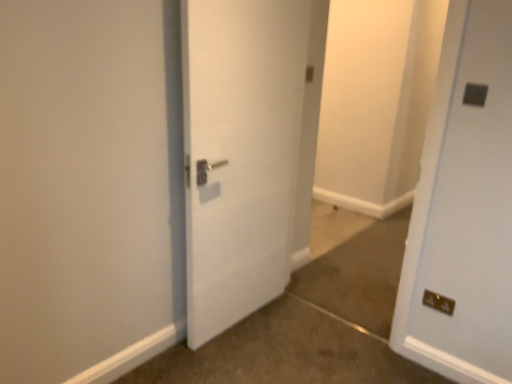
Question: Is brown carpet at lower right to the left or to the right of dark gray plastic electric outlet at upper right, the 1th electric outlet viewed from the front, in the image?

Choices:
 (A) left
 (B) right

Answer: (A)

Question: From a real-world perspective, is brown carpet at lower right positioned above or below dark gray plastic electric outlet at upper right, placed as the 2th electric outlet when sorted from back to front?

Choices:
 (A) above
 (B) below

Answer: (B)

Question: Which is farther from the metallic gold electrical outlet at lower right, which is counted as the second electric outlet, starting from the top?

Choices:
 (A) dark gray plastic electric outlet at upper right, the 1th electric outlet viewed from the front
 (B) brown carpet at lower right
 (C) white matte door at center

Answer: (C)

Question: Which is nearer to the dark gray plastic electric outlet at upper right, placed as the 2th electric outlet when sorted from back to front?

Choices:
 (A) white matte door at center
 (B) brown carpet at lower right
 (C) metallic gold electrical outlet at lower right, placed as the first electric outlet when sorted from back to front

Answer: (C)